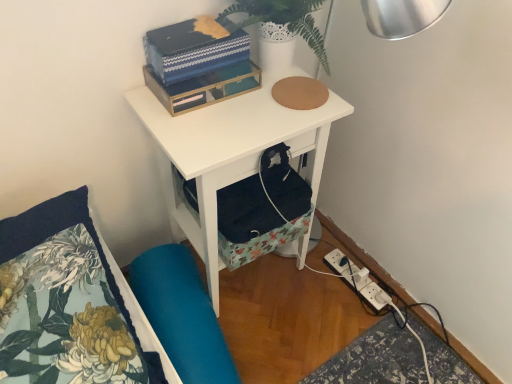
At what (x,y) coordinates should I click in order to perform the action: click on free space in front of white matte nightstand at upper center. Please return your answer as a coordinate pair (x, y). The image size is (512, 384). Looking at the image, I should click on (276, 343).